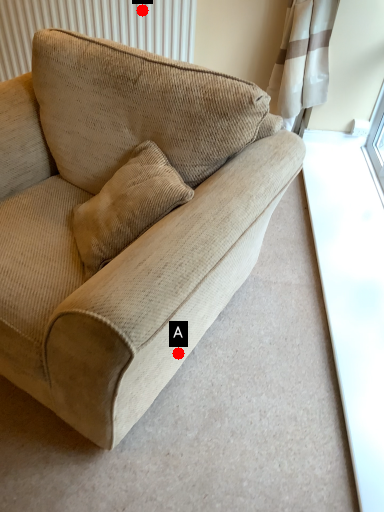
Question: Two points are circled on the image, labeled by A and B beside each circle. Which point is farther from the camera taking this photo?

Choices:
 (A) A is further
 (B) B is further

Answer: (B)